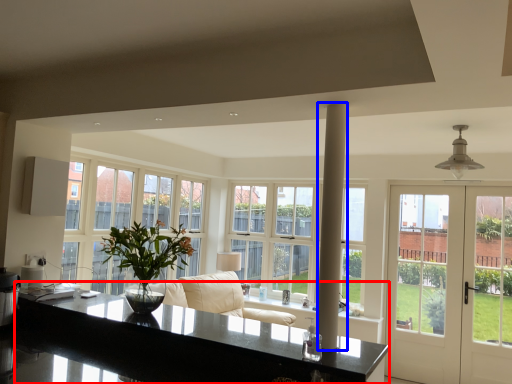
Question: Which of the following is the farthest to the observer, countertop (highlighted by a red box) or pillar (highlighted by a blue box)?

Choices:
 (A) countertop
 (B) pillar

Answer: (B)